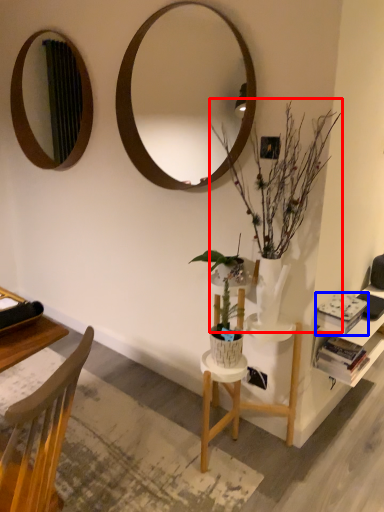
Question: Among these objects, which one is nearest to the camera, houseplant (highlighted by a red box) or book (highlighted by a blue box)?

Choices:
 (A) houseplant
 (B) book

Answer: (A)